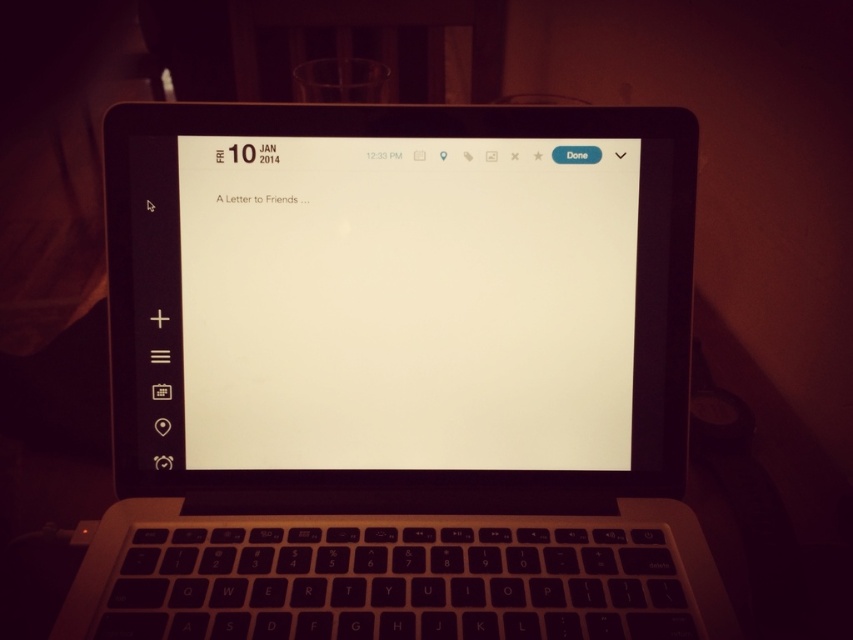
Is sleek black laptop at center closer to camera compared to white paper at center?

That is True.

Measure the distance between sleek black laptop at center and camera.

sleek black laptop at center and camera are 16.18 inches apart.

Is point (115, 268) closer to viewer compared to point (230, 403)?

Yes, it is in front of point (230, 403).

Find the location of a particular element. Image resolution: width=853 pixels, height=640 pixels. sleek black laptop at center is located at coordinates (398, 376).